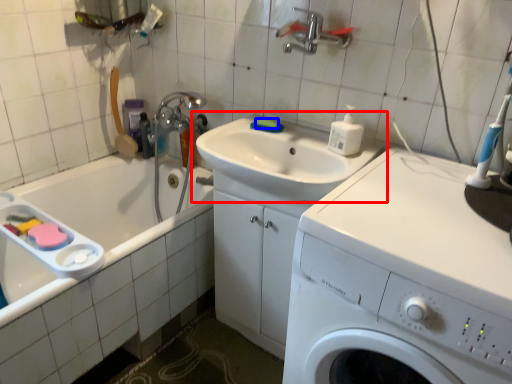
Question: Among these objects, which one is farthest to the camera, sink (highlighted by a red box) or soap (highlighted by a blue box)?

Choices:
 (A) sink
 (B) soap

Answer: (B)